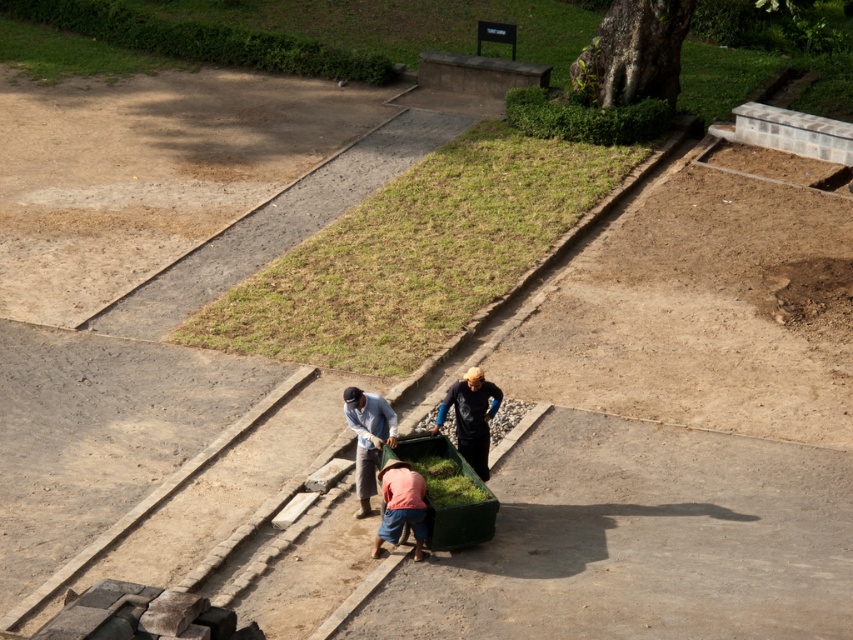
Question: Can you confirm if light blue denim shirt at center is wider than orange fabric pants at center?

Choices:
 (A) yes
 (B) no

Answer: (B)

Question: Does light blue denim shirt at center appear on the right side of orange fabric pants at center?

Choices:
 (A) no
 (B) yes

Answer: (A)

Question: Which object is positioned farthest from the orange fabric pants at center?

Choices:
 (A) green matte cart at center
 (B) light blue denim shirt at center

Answer: (B)

Question: Among these objects, which one is nearest to the camera?

Choices:
 (A) black matte shirt at center
 (B) light blue denim shirt at center

Answer: (B)

Question: Which of the following is the farthest from the observer?

Choices:
 (A) green matte cart at center
 (B) light blue denim shirt at center
 (C) orange fabric pants at center

Answer: (B)

Question: Is green matte cart at center bigger than orange fabric pants at center?

Choices:
 (A) no
 (B) yes

Answer: (B)